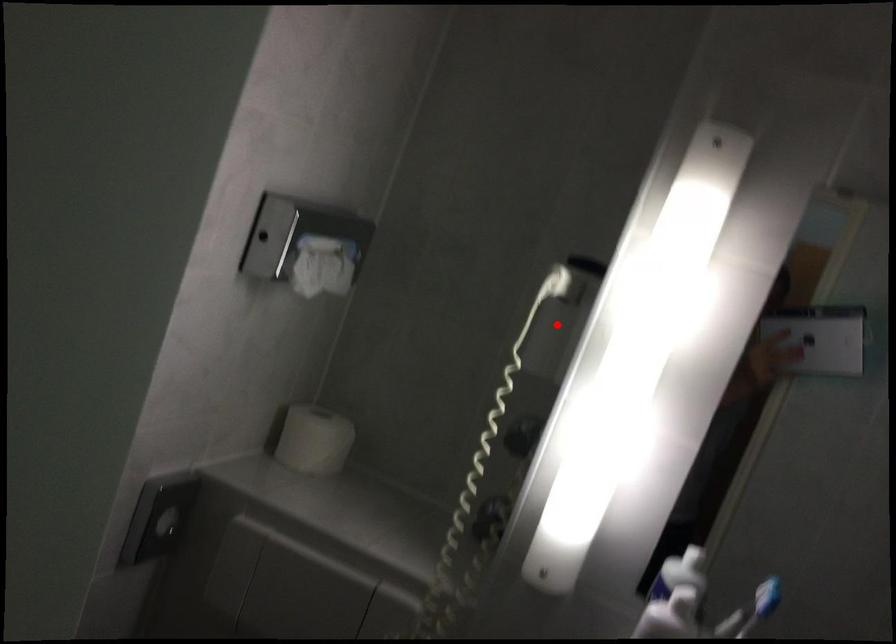
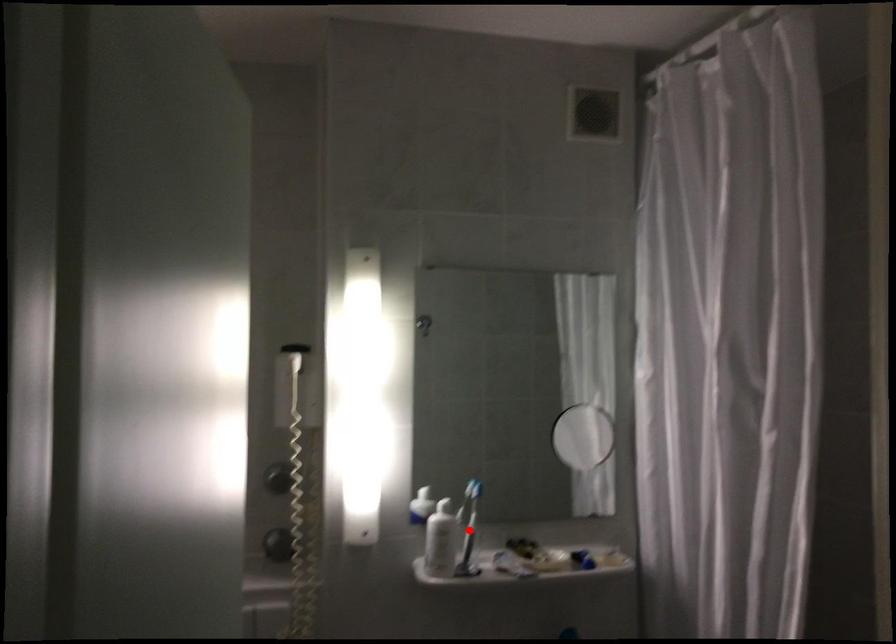
I am providing you with two images of the same scene from different viewpoints. A red point is marked on the first image and another point is marked on the second image. Are the points marked in image1 and image2 representing the same 3D position?

No